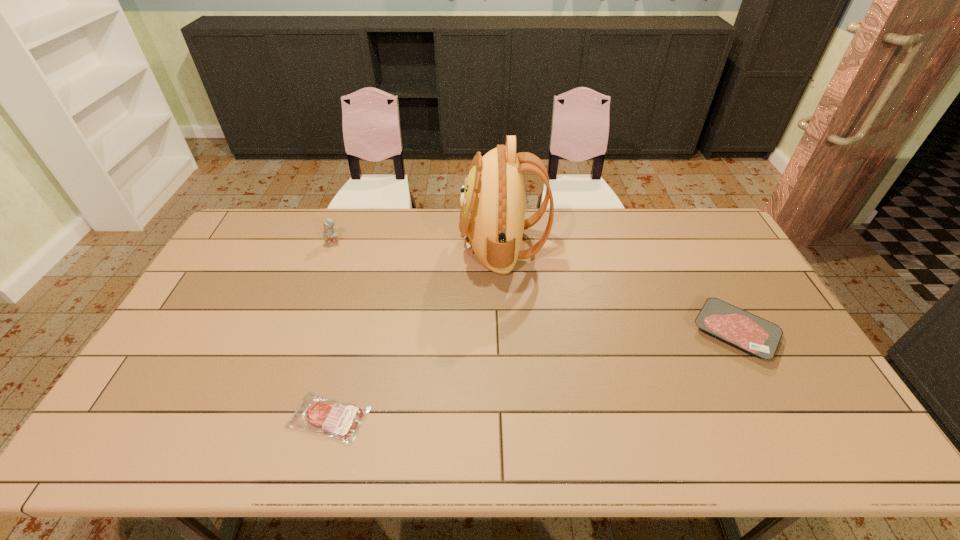
Where is `vacant space that satisfies the following two spatial constraints: 1. on the front-facing side of the backpack; 2. on the back side of the taller steak`? This screenshot has width=960, height=540. vacant space that satisfies the following two spatial constraints: 1. on the front-facing side of the backpack; 2. on the back side of the taller steak is located at coordinates (508, 333).

The image size is (960, 540). I want to click on free point that satisfies the following two spatial constraints: 1. on the front-facing side of the second object from right to left; 2. on the front side of the shorter steak, so click(513, 417).

Locate an element on the screen. free point that satisfies the following two spatial constraints: 1. on the front-facing side of the third shortest object; 2. on the right side of the nearest object is located at coordinates point(268,417).